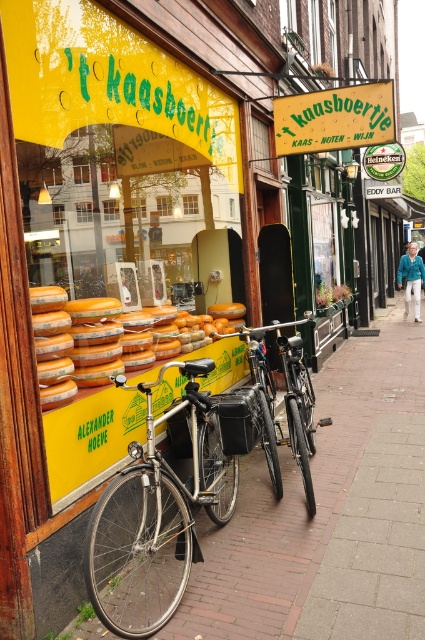
Consider the image. Is orange cheese at center below shiny metallic bicycle at center?

No.

Can you confirm if orange cheese at center is bigger than shiny metallic bicycle at center?

No, orange cheese at center is not bigger than shiny metallic bicycle at center.

This screenshot has height=640, width=425. In order to click on orange cheese at center in this screenshot , I will do `click(98, 346)`.

Locate an element on the screen. The height and width of the screenshot is (640, 425). orange cheese at center is located at coordinates (98, 346).

Can you confirm if brick pavement at center is positioned below orange cheese at center?

Yes, brick pavement at center is below orange cheese at center.

You are a GUI agent. You are given a task and a screenshot of the screen. Output one action in this format:
    pyautogui.click(x=<x>, y=<y>)
    Task: Click on the brick pavement at center
    The width and height of the screenshot is (425, 640).
    Given the screenshot: What is the action you would take?
    pyautogui.click(x=322, y=468)

Who is shorter, shiny silver bicycle at center or brick pavement at center?

Standing shorter between the two is shiny silver bicycle at center.

This screenshot has width=425, height=640. What do you see at coordinates (158, 516) in the screenshot? I see `shiny silver bicycle at center` at bounding box center [158, 516].

Who is more forward, (164, 522) or (274, 538)?

Point (274, 538) is more forward.

Locate an element on the screen. This screenshot has width=425, height=640. shiny silver bicycle at center is located at coordinates (158, 516).